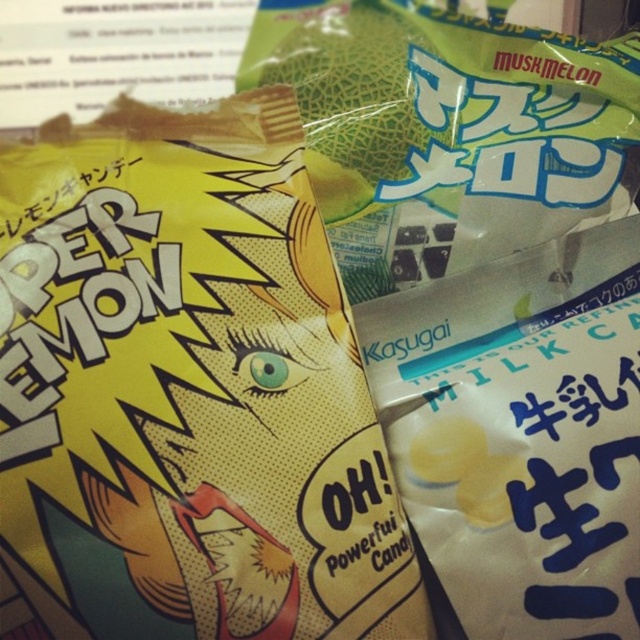
Question: Can you confirm if yellow glossy candy at center is positioned to the right of green melon at center?

Choices:
 (A) yes
 (B) no

Answer: (B)

Question: Which object appears farthest from the camera in this image?

Choices:
 (A) green melon at center
 (B) yellow glossy candy at center

Answer: (A)

Question: Which object is closer to the camera taking this photo?

Choices:
 (A) yellow glossy candy at center
 (B) green melon at center

Answer: (A)

Question: Is yellow glossy candy at center bigger than green melon at center?

Choices:
 (A) yes
 (B) no

Answer: (A)

Question: Does yellow glossy candy at center have a smaller size compared to green melon at center?

Choices:
 (A) no
 (B) yes

Answer: (A)